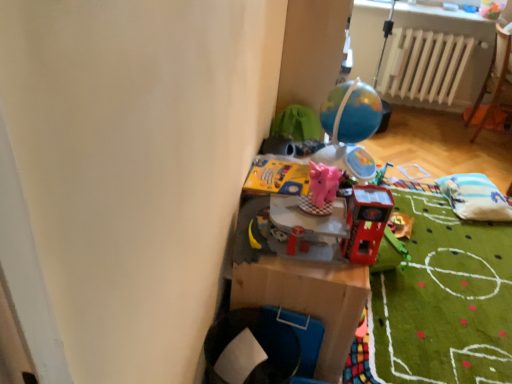
Question: Would you say yellow cardboard book at center, positioned as the 2th toy in back-to-front order, is part of white fabric bean bag at right's contents?

Choices:
 (A) yes
 (B) no

Answer: (B)

Question: Can you confirm if white fabric bean bag at right is shorter than yellow cardboard book at center, marked as the 3th toy in a front-to-back arrangement?

Choices:
 (A) no
 (B) yes

Answer: (A)

Question: Is white fabric bean bag at right outside of yellow cardboard book at center, marked as the 3th toy in a front-to-back arrangement?

Choices:
 (A) no
 (B) yes

Answer: (B)

Question: Is white fabric bean bag at right positioned behind yellow cardboard book at center, marked as the 3th toy in a front-to-back arrangement?

Choices:
 (A) no
 (B) yes

Answer: (B)

Question: Is white fabric bean bag at right wider than yellow cardboard book at center, marked as the 3th toy in a front-to-back arrangement?

Choices:
 (A) no
 (B) yes

Answer: (B)

Question: Would you say white fabric bean bag at right is a long distance from yellow cardboard book at center, marked as the 3th toy in a front-to-back arrangement?

Choices:
 (A) no
 (B) yes

Answer: (B)

Question: Is pink rubber elephant at center, which appears as the 2th toy when viewed from the front, located within white matte radiator at upper right?

Choices:
 (A) yes
 (B) no

Answer: (B)

Question: Considering the relative positions of white matte radiator at upper right and pink rubber elephant at center, which appears as the 2th toy when viewed from the front, in the image provided, is white matte radiator at upper right to the left of pink rubber elephant at center, which appears as the 2th toy when viewed from the front, from the viewer's perspective?

Choices:
 (A) no
 (B) yes

Answer: (A)

Question: From a real-world perspective, does white matte radiator at upper right stand above pink rubber elephant at center, which appears as the 2th toy when viewed from the front?

Choices:
 (A) yes
 (B) no

Answer: (B)

Question: Can you confirm if white matte radiator at upper right is wider than pink rubber elephant at center, the 3th toy in the back-to-front sequence?

Choices:
 (A) no
 (B) yes

Answer: (B)

Question: From the image's perspective, is white matte radiator at upper right under pink rubber elephant at center, which appears as the 2th toy when viewed from the front?

Choices:
 (A) yes
 (B) no

Answer: (B)

Question: Could you tell me if white matte radiator at upper right is turned towards pink rubber elephant at center, the 3th toy in the back-to-front sequence?

Choices:
 (A) no
 (B) yes

Answer: (B)

Question: Considering the relative sizes of shiny metallic globe at upper center, the 4th toy positioned from the front, and white matte radiator at upper right in the image provided, is shiny metallic globe at upper center, the 4th toy positioned from the front, wider than white matte radiator at upper right?

Choices:
 (A) yes
 (B) no

Answer: (A)